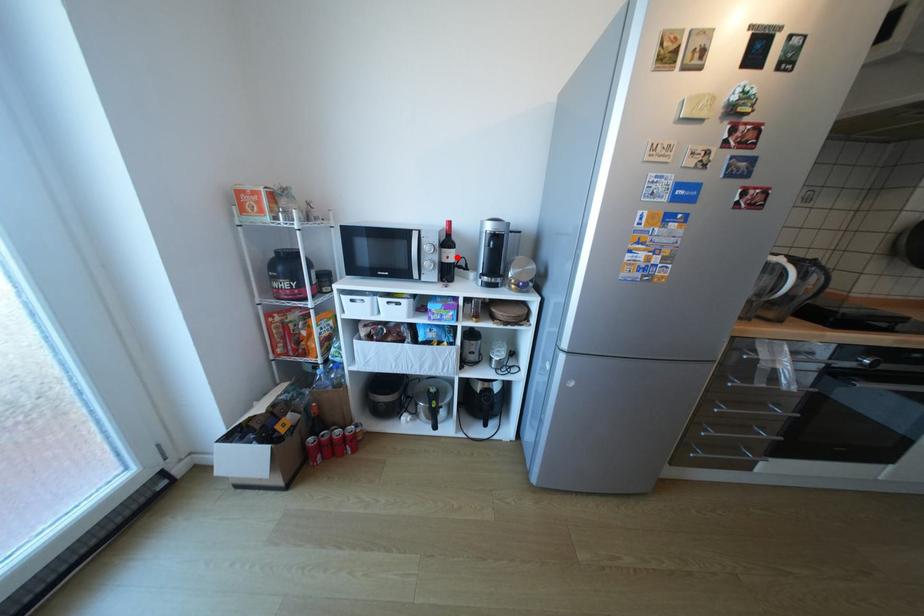
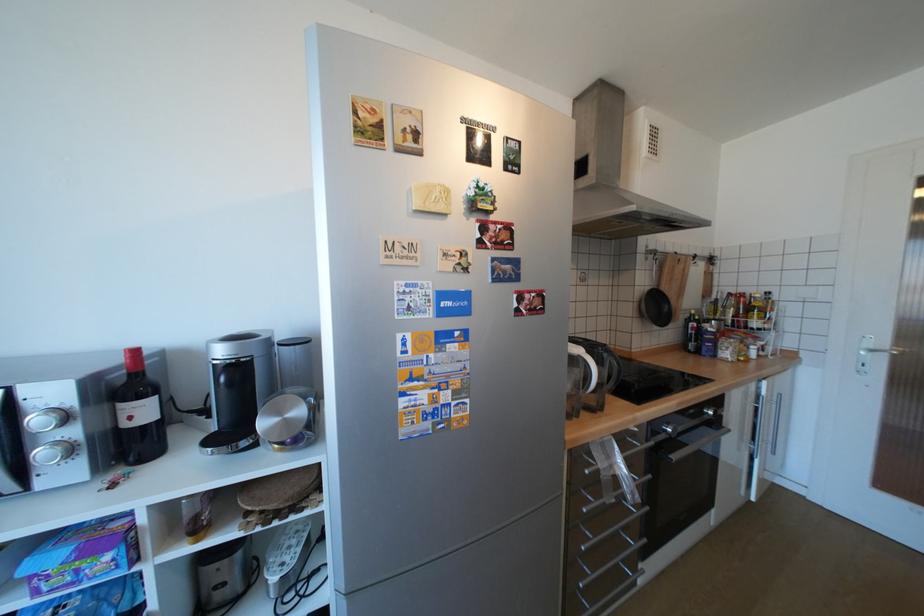
The point at the highlighted location is marked in the first image. Where is the corresponding point in the second image?

(140, 418)